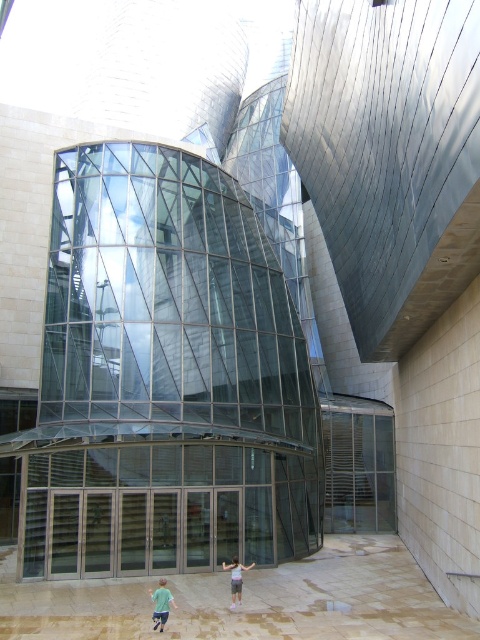
Question: In this image, where is green matte shirt at lower center located relative to light blue denim shorts at center?

Choices:
 (A) above
 (B) below

Answer: (A)

Question: Which point is closer to the camera?

Choices:
 (A) light blue denim shorts at center
 (B) green matte shirt at lower center

Answer: (B)

Question: Which of the following is the farthest from the observer?

Choices:
 (A) (160, 584)
 (B) (236, 595)

Answer: (B)

Question: Which of the following is the farthest from the observer?

Choices:
 (A) (156, 596)
 (B) (240, 570)

Answer: (B)

Question: Is green matte shirt at lower center thinner than light blue denim shorts at center?

Choices:
 (A) yes
 (B) no

Answer: (B)

Question: Is green matte shirt at lower center above light blue denim shorts at center?

Choices:
 (A) no
 (B) yes

Answer: (B)